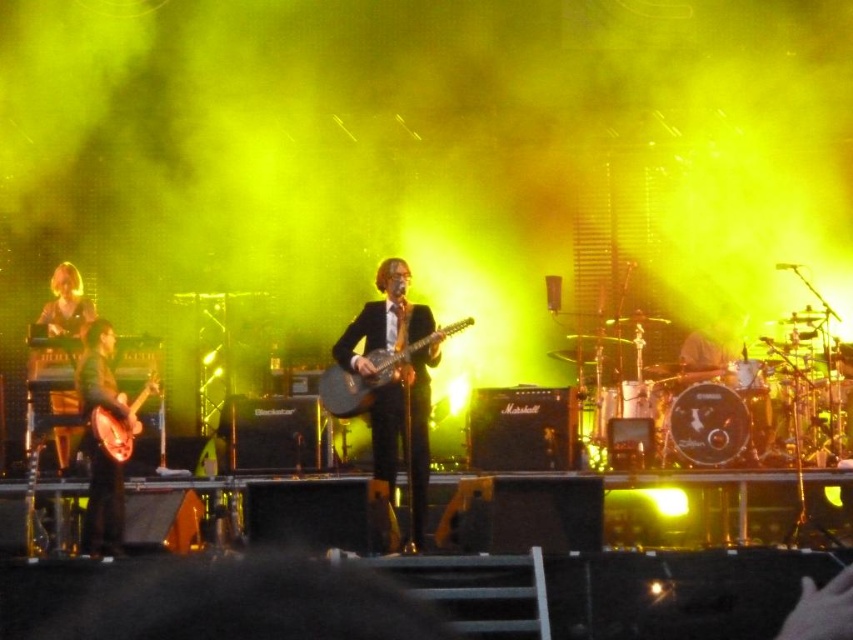
Which is below, black glossy suit at center or golden hair at left?

black glossy suit at center is below.

Based on the photo, is black glossy suit at center taller than golden hair at left?

Correct, black glossy suit at center is much taller as golden hair at left.

Is point (421, 419) closer to camera compared to point (79, 273)?

That is True.

Locate an element on the screen. This screenshot has height=640, width=853. black glossy suit at center is located at coordinates (405, 433).

Does matte brown guitar at left have a greater height compared to matte black guitar at center?

Yes, matte brown guitar at left is taller than matte black guitar at center.

Is point (86, 540) positioned behind point (338, 364)?

No.

In order to click on matte brown guitar at left in this screenshot , I will do `click(103, 500)`.

Who is shorter, matte black guitar at center or shiny silver drum at center?

shiny silver drum at center

Who is lower down, matte black guitar at center or shiny silver drum at center?

Positioned lower is matte black guitar at center.

The width and height of the screenshot is (853, 640). What do you see at coordinates (375, 372) in the screenshot? I see `matte black guitar at center` at bounding box center [375, 372].

Where is `matte black guitar at center`? The width and height of the screenshot is (853, 640). matte black guitar at center is located at coordinates (375, 372).